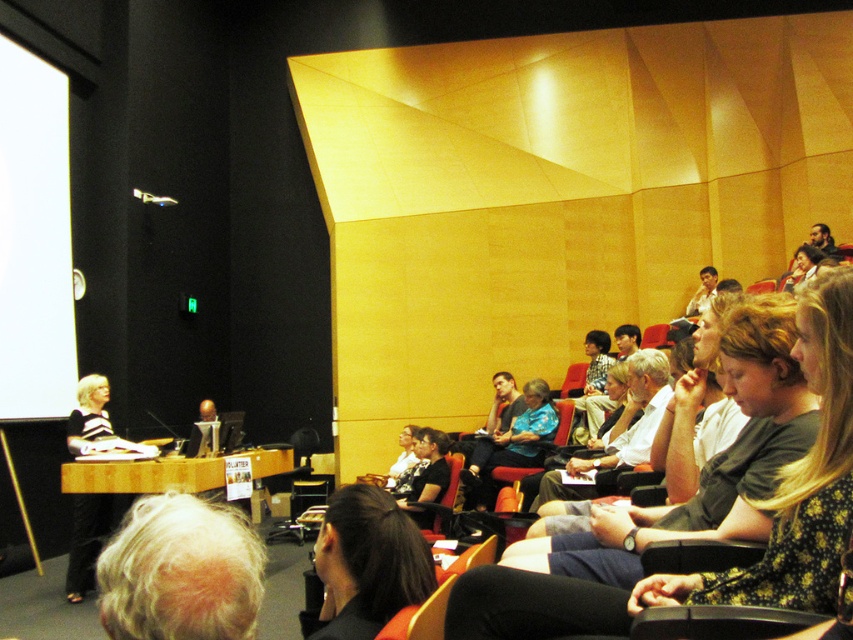
Is point (831, 332) positioned behind point (42, 413)?

No.

Who is positioned more to the right, floral-patterned shirt at center or white matte projection screen at left?

floral-patterned shirt at center is more to the right.

Who is more distant from viewer, (x=816, y=301) or (x=32, y=314)?

The point (x=32, y=314) is behind.

Image resolution: width=853 pixels, height=640 pixels. In order to click on floral-patterned shirt at center in this screenshot , I will do `click(738, 502)`.

Does blue floral shirt at center appear under matte black shirt at upper right?

Yes.

Is point (468, 467) less distant than point (706, 304)?

That is True.

Is point (554, 424) positioned before point (714, 269)?

Yes, it is in front of point (714, 269).

This screenshot has height=640, width=853. What are the coordinates of `blue floral shirt at center` in the screenshot? It's located at (511, 444).

Is white matte projection screen at left positioned in front of matte black shirt at upper right?

Yes.

Who is more forward, (50, 68) or (708, 276)?

Point (50, 68) is in front.

Is point (61, 237) closer to viewer compared to point (706, 289)?

Yes.

Find the location of `white matte projection screen at left`. white matte projection screen at left is located at coordinates (33, 240).